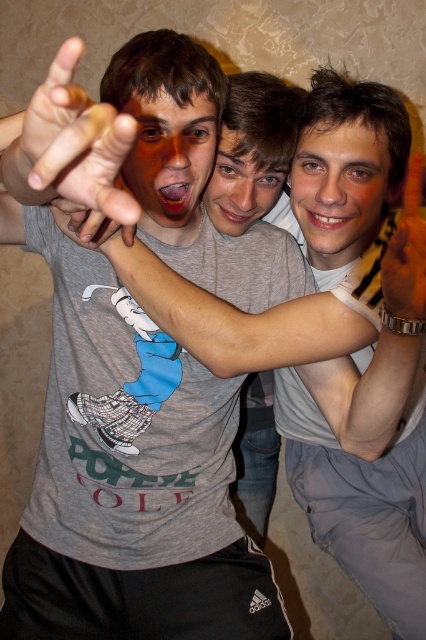
You are standing in front of the image and want to determine which of the two points, point (x=17, y=163) or point (x=417, y=296), is nearer to you. Based on the spatial arrangement in the scene, which point is closer?

Point (x=17, y=163) is closer to the viewer than point (x=417, y=296).